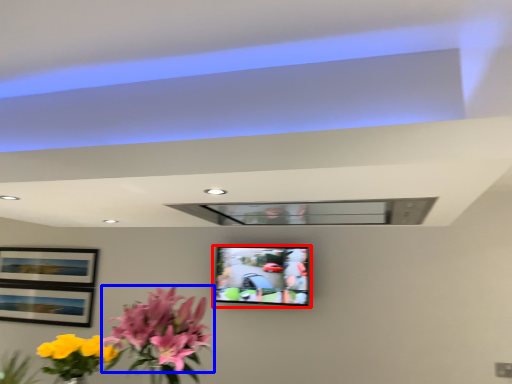
Question: Which point is further to the camera, television (highlighted by a red box) or flower (highlighted by a blue box)?

Choices:
 (A) television
 (B) flower

Answer: (A)